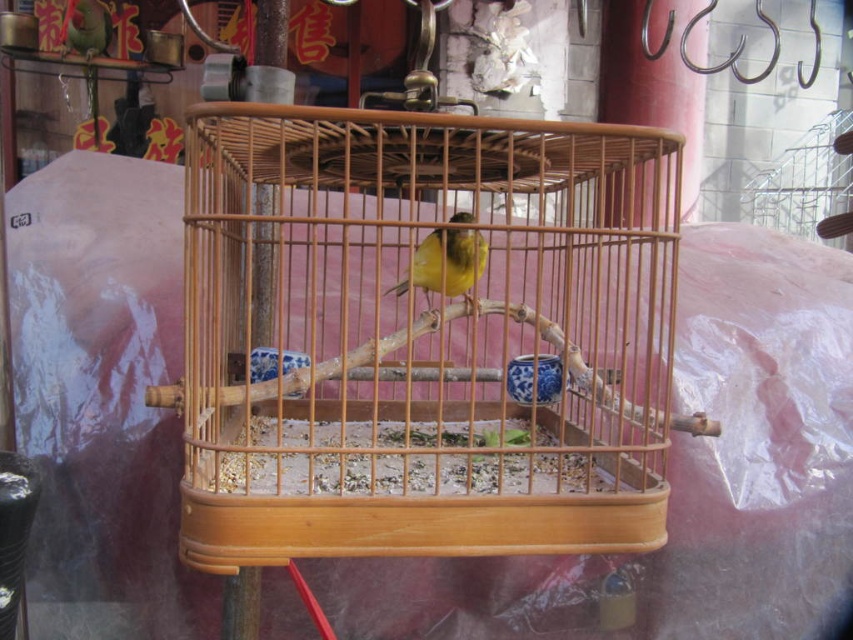
You are a customer in a pet store and see the wooden birdcage at center and the yellow matte canary at center. Which object is positioned more to the right side of the image?

The wooden birdcage at center is positioned more to the right side of the image than the yellow matte canary at center.

Based on the photo, you are standing in a shop and see the wooden birdcage at center. If you want to reach into the cage to feed the bird, will your hand be able to comfortably fit inside the cage opening?

The wooden birdcage at center is 81.68 centimeters away from viewer, so your hand can comfortably fit inside the cage opening as the distance allows for easy access.